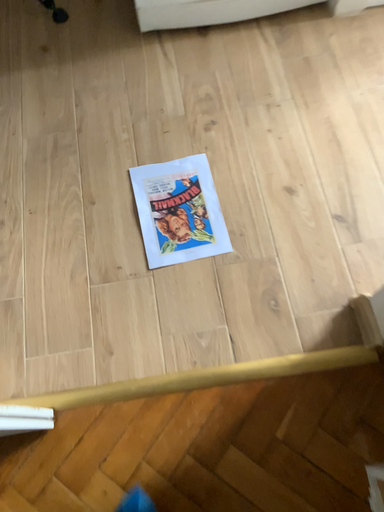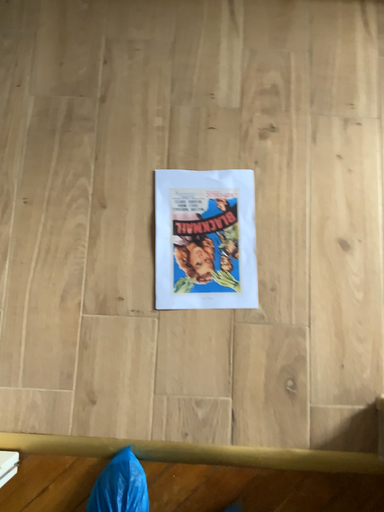
Question: Which way did the camera rotate in the video?

Choices:
 (A) rotated upward
 (B) rotated downward

Answer: (B)